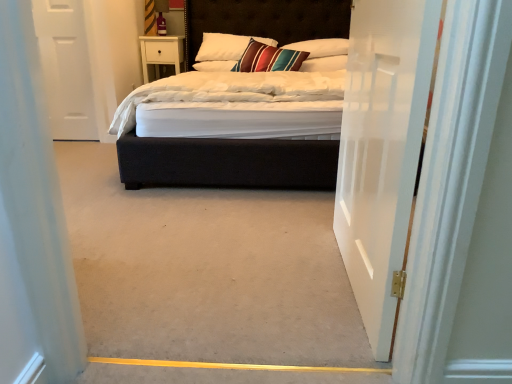
Question: Does white glossy door at center, which is the 2th door from left to right, lie behind velvet-like multicolored pillow at center, which is the second pillow from left to right?

Choices:
 (A) yes
 (B) no

Answer: (B)

Question: Considering the relative sizes of white glossy door at center, which is counted as the 2th door, starting from the back, and velvet-like multicolored pillow at center, which appears as the 3th pillow when viewed from the right, in the image provided, is white glossy door at center, which is counted as the 2th door, starting from the back, bigger than velvet-like multicolored pillow at center, which appears as the 3th pillow when viewed from the right,?

Choices:
 (A) yes
 (B) no

Answer: (B)

Question: Considering the relative positions of white glossy door at center, the 1th door positioned from the front, and velvet-like multicolored pillow at center, which is the second pillow from left to right, in the image provided, is white glossy door at center, the 1th door positioned from the front, to the left of velvet-like multicolored pillow at center, which is the second pillow from left to right, from the viewer's perspective?

Choices:
 (A) yes
 (B) no

Answer: (B)

Question: Is the depth of white glossy door at center, which is counted as the 2th door, starting from the back, less than that of velvet-like multicolored pillow at center, which appears as the 3th pillow when viewed from the right?

Choices:
 (A) yes
 (B) no

Answer: (A)

Question: Does white glossy door at center, arranged as the 1th door when viewed from the right, contain velvet-like multicolored pillow at center, which appears as the 3th pillow when viewed from the right?

Choices:
 (A) yes
 (B) no

Answer: (B)

Question: In the image, is white glossy door at center, arranged as the 1th door when viewed from the right, positioned in front of or behind velvet-like multicolored pillow at center, which is the second pillow from left to right?

Choices:
 (A) behind
 (B) front

Answer: (B)

Question: From the image's perspective, is white glossy door at center, arranged as the 1th door when viewed from the right, located above or below velvet-like multicolored pillow at center, which is the second pillow from left to right?

Choices:
 (A) above
 (B) below

Answer: (B)

Question: Is white glossy door at center, arranged as the 1th door when viewed from the right, inside the boundaries of velvet-like multicolored pillow at center, which is the second pillow from left to right, or outside?

Choices:
 (A) inside
 (B) outside

Answer: (B)

Question: Based on their positions, is white glossy door at center, arranged as the 1th door when viewed from the right, located to the left or right of velvet-like multicolored pillow at center, which appears as the 3th pillow when viewed from the right?

Choices:
 (A) right
 (B) left

Answer: (A)

Question: Which is correct: white soft pillow at upper center, which ranks as the fourth pillow in left-to-right order, is inside velvet-like multicolored pillow at center, which appears as the 3th pillow when viewed from the right, or outside of it?

Choices:
 (A) inside
 (B) outside

Answer: (B)

Question: In the image, is white soft pillow at upper center, acting as the 1th pillow starting from the right, on the left side or the right side of velvet-like multicolored pillow at center, which is the second pillow from left to right?

Choices:
 (A) right
 (B) left

Answer: (A)

Question: From the image's perspective, is white soft pillow at upper center, acting as the 1th pillow starting from the right, located above or below velvet-like multicolored pillow at center, which appears as the 3th pillow when viewed from the right?

Choices:
 (A) below
 (B) above

Answer: (A)

Question: Is point (324, 67) closer or farther from the camera than point (274, 43)?

Choices:
 (A) farther
 (B) closer

Answer: (B)

Question: In the image, is velvet black bed at center positioned in front of or behind velvet-like multicolored pillow at center, which appears as the 3th pillow when viewed from the right?

Choices:
 (A) behind
 (B) front

Answer: (B)

Question: From a real-world perspective, relative to velvet-like multicolored pillow at center, which is the second pillow from left to right, is velvet black bed at center vertically above or below?

Choices:
 (A) below
 (B) above

Answer: (A)